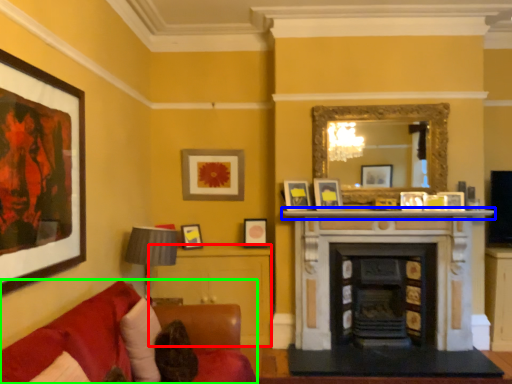
Question: Which object is the closest to the table (highlighted by a red box)? Choose among these: mantle (highlighted by a blue box) or studio couch (highlighted by a green box).

Choices:
 (A) mantle
 (B) studio couch

Answer: (A)